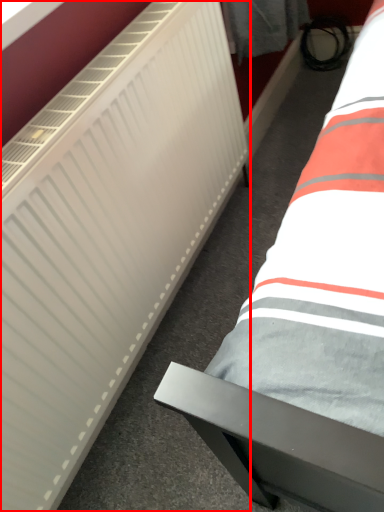
Question: In this image, where is radiator (annotated by the red box) located relative to bed?

Choices:
 (A) right
 (B) left

Answer: (B)